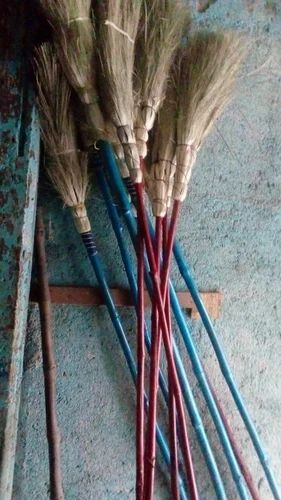
Where is `broom`? broom is located at coordinates (200, 121).